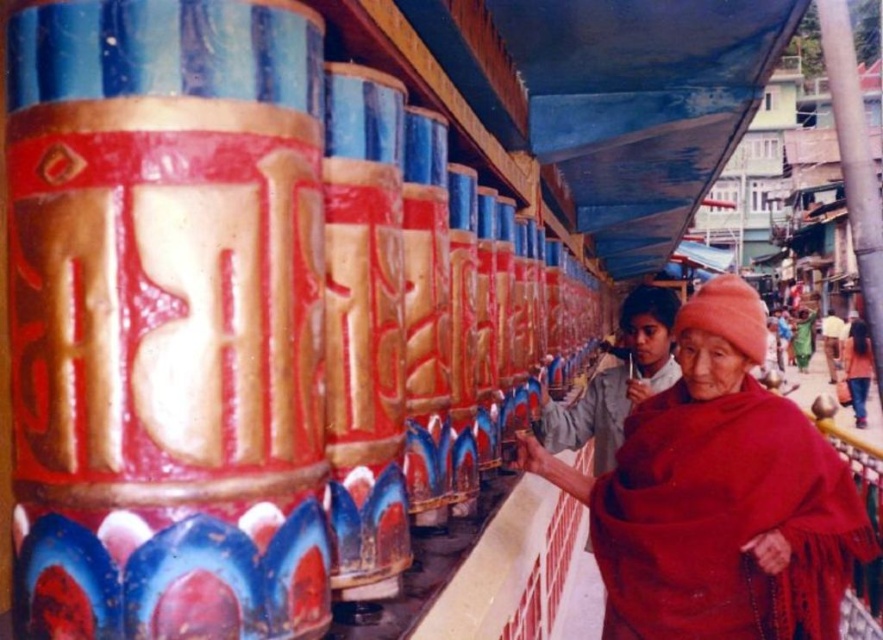
Question: Among these points, which one is farthest from the camera?

Choices:
 (A) (814, 429)
 (B) (608, 452)
 (C) (824, 337)
 (D) (855, 412)

Answer: (C)

Question: Is red woolen robe at right to the left of orange fabric at lower right from the viewer's perspective?

Choices:
 (A) yes
 (B) no

Answer: (A)

Question: Can you confirm if red woolen robe at right is bigger than orange fabric at lower right?

Choices:
 (A) yes
 (B) no

Answer: (B)

Question: Does red woolen robe at lower right have a smaller size compared to orange fabric at lower right?

Choices:
 (A) no
 (B) yes

Answer: (B)

Question: Which point is closer to the camera taking this photo?

Choices:
 (A) (545, 445)
 (B) (841, 330)
 (C) (678, 404)
 (D) (848, 358)

Answer: (C)

Question: Based on their relative distances, which object is farther from the red woolen robe at right?

Choices:
 (A) orange fabric at lower right
 (B) red woolen robe at lower right
 (C) light brown leather jacket at lower right

Answer: (C)